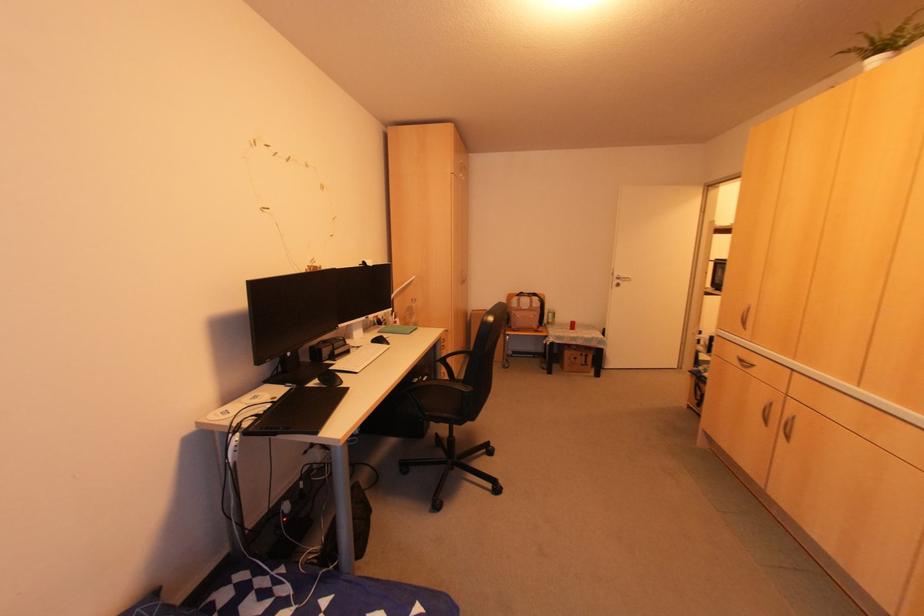
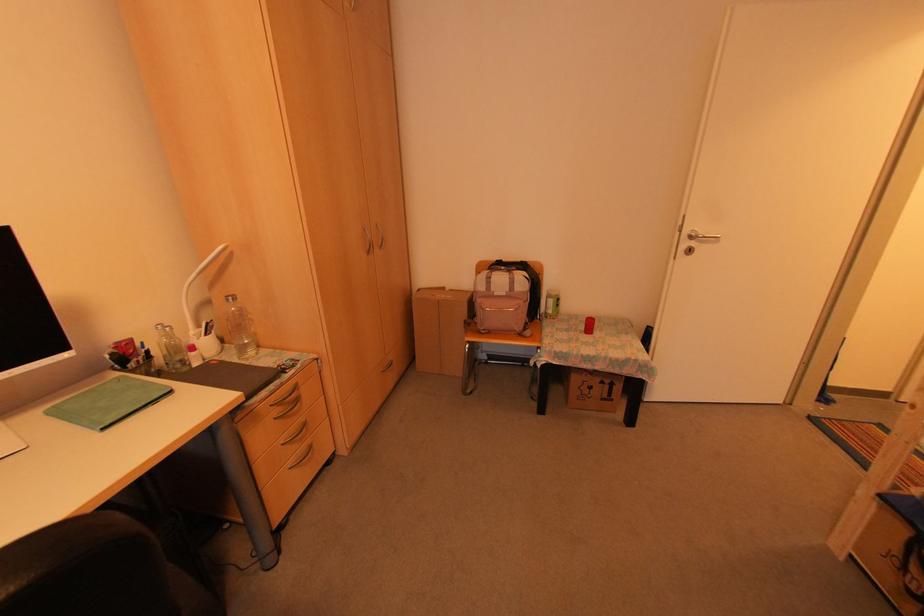
In the second image, find the point that corresponds to (x=511, y=328) in the first image.

(477, 326)